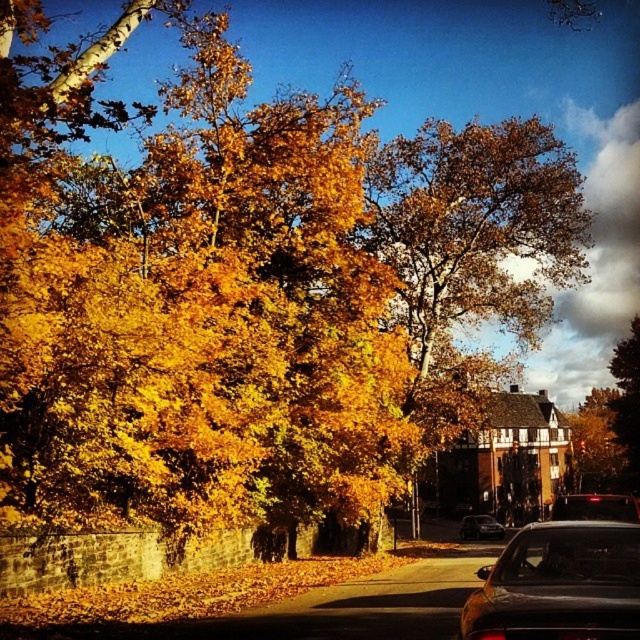
You are a pedestrian standing on the paved road and see the shiny black sedan at lower right and the black glossy car at center. Which car is blocking the other car from view?

The shiny black sedan at lower right is positioned over the black glossy car at center, so it is blocking the view of the black glossy car at center.